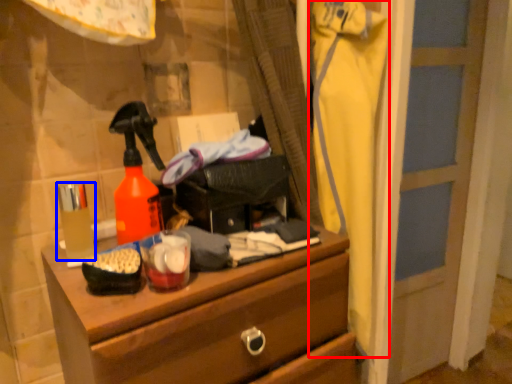
Question: Among these objects, which one is farthest to the camera, clothing (highlighted by a red box) or toiletry (highlighted by a blue box)?

Choices:
 (A) clothing
 (B) toiletry

Answer: (A)